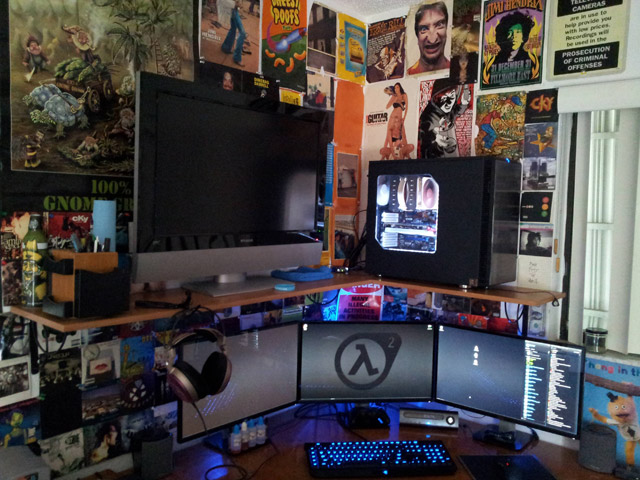
Where is `large tv screen`? Image resolution: width=640 pixels, height=480 pixels. large tv screen is located at coordinates (212, 182).